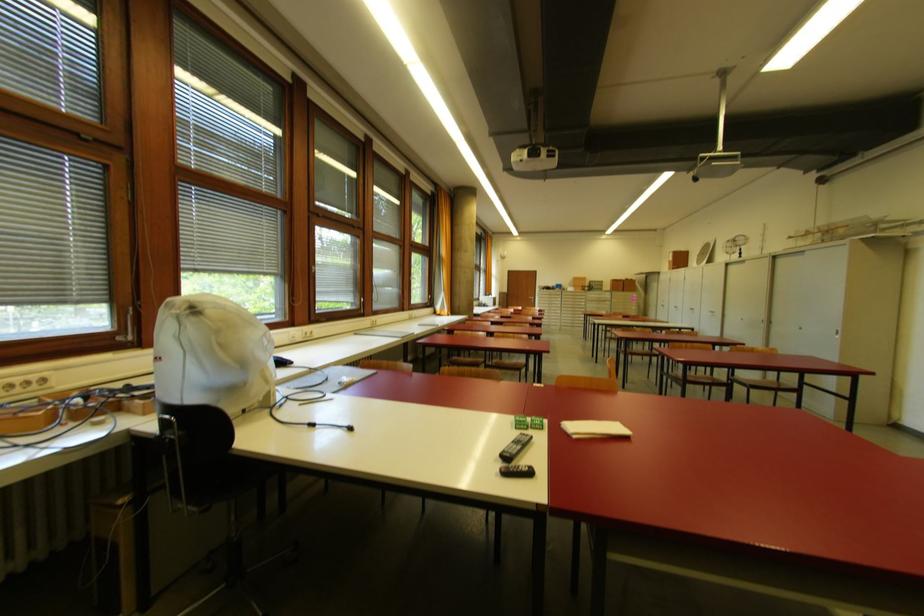
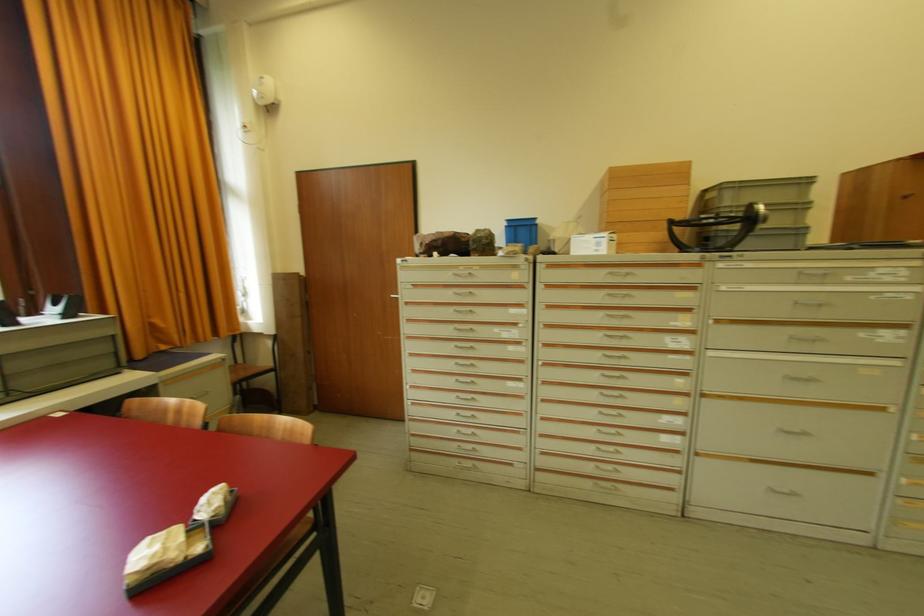
Where in the second image is the point corresponding to [569,292] from the first image?

(570, 254)